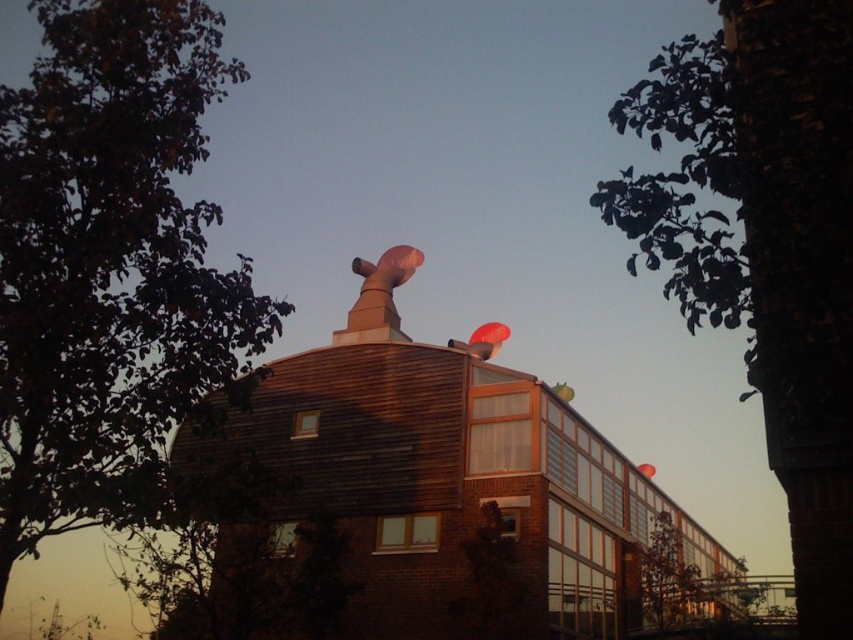
Looking at this image, you are standing in front of the modern building and notice two points marked on the roof. The first point is at coordinate (839, 236) and the second is at (641, 468). Which of these points is closer to you?

Point (839, 236) is closer to the viewer than point (641, 468).

You are an architect assessing the building for potential solar panel installation. Considering the green leafy tree at upper left and the green matte tree at lower right, which tree might cast a longer shadow on the building during the late afternoon sun? Please justify your answer based on their relative sizes.

The green leafy tree at upper left is taller than the green matte tree at lower right. Since taller objects generally cast longer shadows, the green leafy tree at upper left would likely cast a longer shadow on the building during late afternoon sun.

You are an architect reviewing a design plan for the building. You notice the green leafy tree at upper right and the rubber balloon at center. Which object appears closer to the viewer in the design?

The green leafy tree at upper right is in front of the rubber balloon at center, so it appears closer to the viewer.